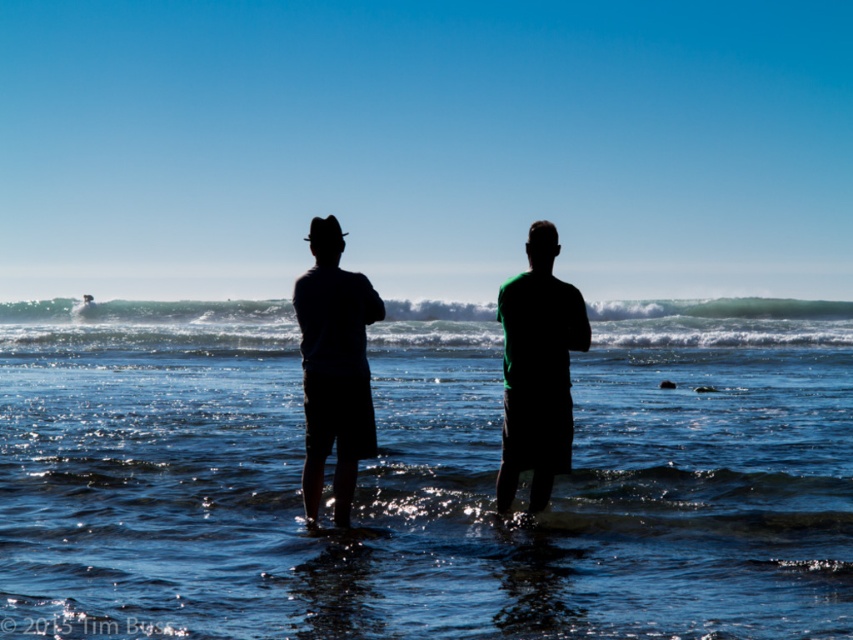
Question: Can you confirm if blue liquid water at center is smaller than green matte shirt at center?

Choices:
 (A) yes
 (B) no

Answer: (B)

Question: Which of the following is the farthest from the observer?

Choices:
 (A) (656, 508)
 (B) (306, 310)

Answer: (A)

Question: Which of these objects is positioned farthest from the green matte shirt at center?

Choices:
 (A) silhouette clothing at center
 (B) black matte shorts at center

Answer: (A)

Question: Does green matte shirt at center appear on the left side of black matte shorts at center?

Choices:
 (A) yes
 (B) no

Answer: (B)

Question: Which of the following is the farthest from the observer?

Choices:
 (A) blue liquid water at center
 (B) silhouette clothing at center

Answer: (B)

Question: Is silhouette clothing at center thinner than green matte shirt at center?

Choices:
 (A) yes
 (B) no

Answer: (A)